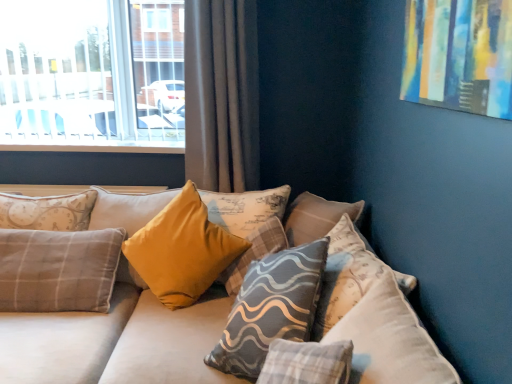
Question: Looking at the image, does gray fabric curtain at upper left seem bigger or smaller compared to velvet beige couch at center?

Choices:
 (A) small
 (B) big

Answer: (A)

Question: Is point (192, 139) closer or farther from the camera than point (287, 347)?

Choices:
 (A) closer
 (B) farther

Answer: (B)

Question: Which of these objects is positioned farthest from the gray fabric curtain at upper left?

Choices:
 (A) clear glass window at upper left
 (B) velvet mustard pillow at center, which is the third pillow in left-to-right order
 (C) velvet beige couch at center
 (D) gray textured pillow at center, marked as the 1th pillow in a right-to-left arrangement
 (E) yellow fabric pillow at center, placed as the 1th pillow when sorted from left to right

Answer: (B)

Question: Which is nearer to the gray fabric curtain at upper left?

Choices:
 (A) gray textured pillow at center, marked as the 2th pillow in a left-to-right arrangement
 (B) velvet beige couch at center
 (C) gray textured pillow at center, acting as the fourth pillow starting from the left
 (D) velvet mustard pillow at center, which is the third pillow in left-to-right order
 (E) yellow fabric pillow at center, the 4th pillow viewed from the right

Answer: (E)